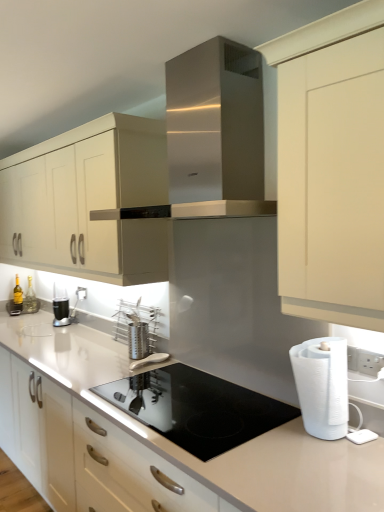
Question: Is stainless steel utensil holder at center, acting as the 1th appliance starting from the top, positioned in front of white matte paper towel at right?

Choices:
 (A) no
 (B) yes

Answer: (A)

Question: Does stainless steel utensil holder at center, which is the 2th appliance in bottom-to-top order, turn towards white matte paper towel at right?

Choices:
 (A) no
 (B) yes

Answer: (A)

Question: Does stainless steel utensil holder at center, acting as the 1th appliance starting from the top, lie behind white matte paper towel at right?

Choices:
 (A) yes
 (B) no

Answer: (A)

Question: From the image's perspective, is stainless steel utensil holder at center, acting as the 1th appliance starting from the top, located beneath white matte paper towel at right?

Choices:
 (A) no
 (B) yes

Answer: (A)

Question: Considering the relative sizes of stainless steel utensil holder at center, acting as the 1th appliance starting from the top, and white matte paper towel at right in the image provided, is stainless steel utensil holder at center, acting as the 1th appliance starting from the top, wider than white matte paper towel at right?

Choices:
 (A) no
 (B) yes

Answer: (A)

Question: Which is correct: stainless steel utensil holder at center, acting as the 1th appliance starting from the top, is inside metallic silver coffee machine at left, or outside of it?

Choices:
 (A) inside
 (B) outside

Answer: (B)

Question: Is stainless steel utensil holder at center, acting as the 1th appliance starting from the top, bigger or smaller than metallic silver coffee machine at left?

Choices:
 (A) big
 (B) small

Answer: (A)

Question: From the image's perspective, is stainless steel utensil holder at center, which is the 2th appliance in bottom-to-top order, above or below metallic silver coffee machine at left?

Choices:
 (A) below
 (B) above

Answer: (A)

Question: From a real-world perspective, relative to metallic silver coffee machine at left, is stainless steel utensil holder at center, which is the 2th appliance in bottom-to-top order, vertically above or below?

Choices:
 (A) above
 (B) below

Answer: (B)

Question: Considering the positions of stainless steel utensil holder at center, which is the 2th appliance in bottom-to-top order, and translucent glass bottle at left, placed as the 1th bottle when sorted from left to right, in the image, is stainless steel utensil holder at center, which is the 2th appliance in bottom-to-top order, bigger or smaller than translucent glass bottle at left, placed as the 1th bottle when sorted from left to right,?

Choices:
 (A) small
 (B) big

Answer: (B)

Question: From a real-world perspective, relative to translucent glass bottle at left, acting as the second bottle starting from the right, is stainless steel utensil holder at center, acting as the 1th appliance starting from the top, vertically above or below?

Choices:
 (A) above
 (B) below

Answer: (B)

Question: Is stainless steel utensil holder at center, which is the 2th appliance in bottom-to-top order, to the left or to the right of translucent glass bottle at left, placed as the 1th bottle when sorted from left to right, in the image?

Choices:
 (A) right
 (B) left

Answer: (A)

Question: Is point (142, 308) positioned closer to the camera than point (18, 294)?

Choices:
 (A) closer
 (B) farther

Answer: (A)

Question: Considering the positions of point (18, 286) and point (81, 298), is point (18, 286) closer or farther from the camera than point (81, 298)?

Choices:
 (A) farther
 (B) closer

Answer: (A)

Question: From the image's perspective, is translucent glass bottle at left, placed as the 1th bottle when sorted from left to right, above or below white plastic electric outlet at upper right?

Choices:
 (A) above
 (B) below

Answer: (B)